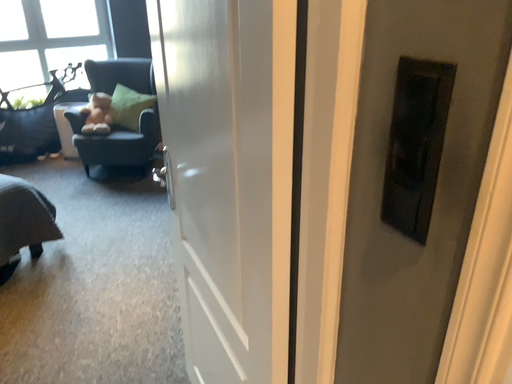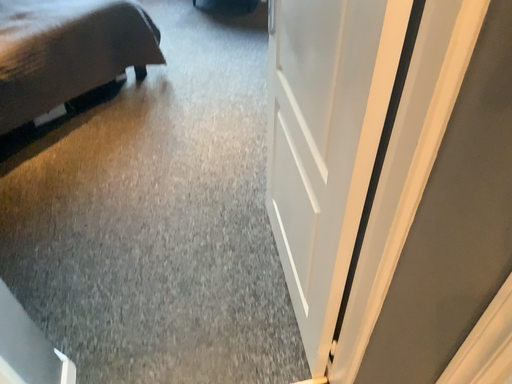
Question: How did the camera likely rotate when shooting the video?

Choices:
 (A) rotated downward
 (B) rotated upward

Answer: (A)